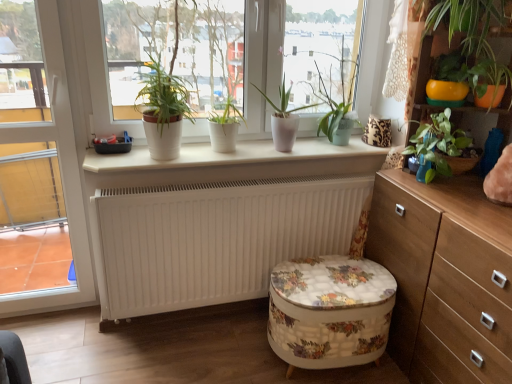
Identify the location of free spot above white matte window sill at center (from a real-world perspective). The image size is (512, 384). (261, 150).